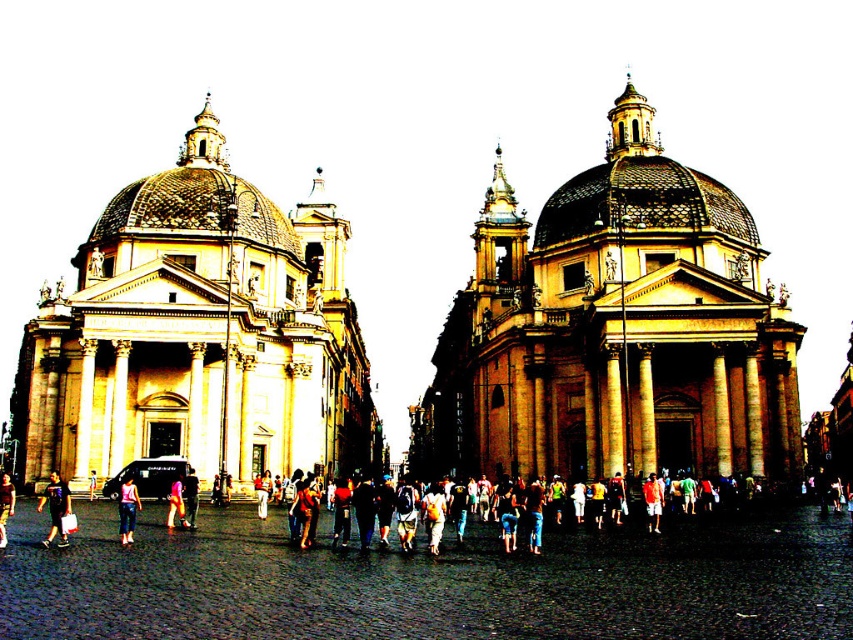
Question: Is dark blue t-shirt at center thinner than light pink fabric dress at center?

Choices:
 (A) yes
 (B) no

Answer: (B)

Question: Is brown cobblestone plaza at center thinner than pink fabric at center?

Choices:
 (A) no
 (B) yes

Answer: (A)

Question: Which object is farther from the camera taking this photo?

Choices:
 (A) light pink fabric dress at center
 (B) pink fabric at center
 (C) brown stone church at center
 (D) orange t-shirt at center

Answer: (C)

Question: Which object appears closest to the camera in this image?

Choices:
 (A) beige stone church at left
 (B) denim pants at lower left
 (C) light pink fabric dress at center

Answer: (B)

Question: Among these objects, which one is nearest to the camera?

Choices:
 (A) dark blue t-shirt at center
 (B) pink denim jeans at center
 (C) pink fabric at center
 (D) denim pants at lower left

Answer: (D)

Question: Is beige stone church at left above pink denim jeans at center?

Choices:
 (A) yes
 (B) no

Answer: (A)